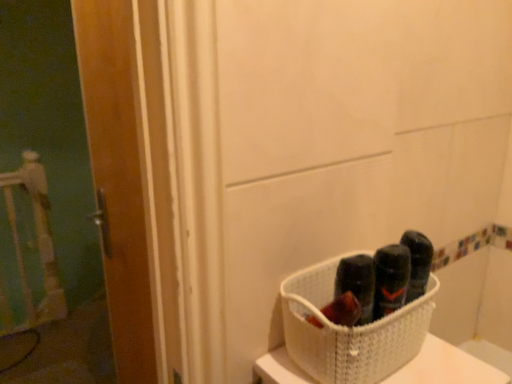
Question: From a real-world perspective, is wooden door at left positioned above or below white woven basket at lower right?

Choices:
 (A) above
 (B) below

Answer: (B)

Question: Considering the relative positions of wooden door at left and white woven basket at lower right in the image provided, is wooden door at left to the left or to the right of white woven basket at lower right?

Choices:
 (A) left
 (B) right

Answer: (A)

Question: Is wooden door at left bigger or smaller than white woven basket at lower right?

Choices:
 (A) small
 (B) big

Answer: (B)

Question: In the image, is white woven basket at lower right on the left side or the right side of wooden door at left?

Choices:
 (A) right
 (B) left

Answer: (A)

Question: From the image's perspective, relative to wooden door at left, is white woven basket at lower right above or below?

Choices:
 (A) below
 (B) above

Answer: (A)

Question: In terms of height, does white woven basket at lower right look taller or shorter compared to wooden door at left?

Choices:
 (A) short
 (B) tall

Answer: (A)

Question: From a real-world perspective, is white woven basket at lower right physically located above or below wooden door at left?

Choices:
 (A) above
 (B) below

Answer: (A)